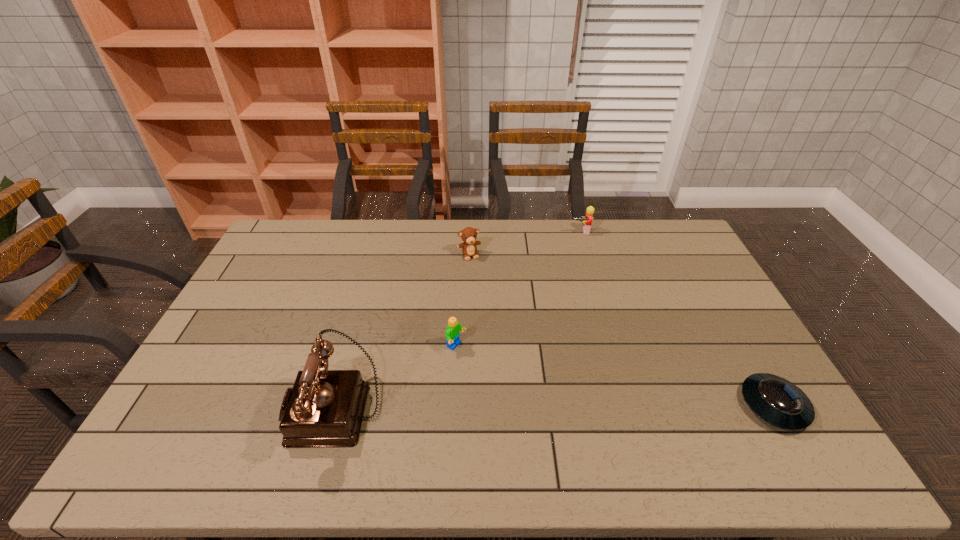
Where is `telephone`? telephone is located at coordinates (325, 408).

Identify the location of the tallest object. Image resolution: width=960 pixels, height=540 pixels. (325, 408).

This screenshot has height=540, width=960. What are the coordinates of `the rightmost object` in the screenshot? It's located at (779, 402).

You are a GUI agent. You are given a task and a screenshot of the screen. Output one action in this format:
    pyautogui.click(x=<x>, y=<y>)
    Task: Click on the saucer
    
    Given the screenshot: What is the action you would take?
    pyautogui.click(x=779, y=402)

The height and width of the screenshot is (540, 960). In order to click on teddy bear in this screenshot , I will do `click(469, 234)`.

The image size is (960, 540). I want to click on the nearer Lego, so click(x=452, y=334).

Image resolution: width=960 pixels, height=540 pixels. I want to click on the third farthest object, so click(452, 334).

The width and height of the screenshot is (960, 540). I want to click on the second object from right to left, so click(x=588, y=218).

Image resolution: width=960 pixels, height=540 pixels. I want to click on the right Lego, so click(x=588, y=218).

Locate an element on the screen. The height and width of the screenshot is (540, 960). free space located on the dial of the leftmost object is located at coordinates (257, 408).